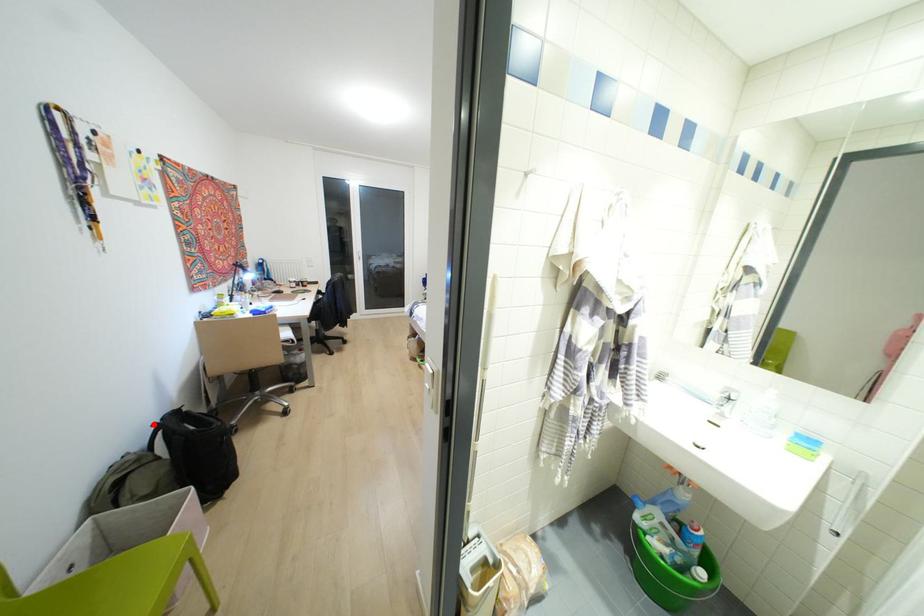
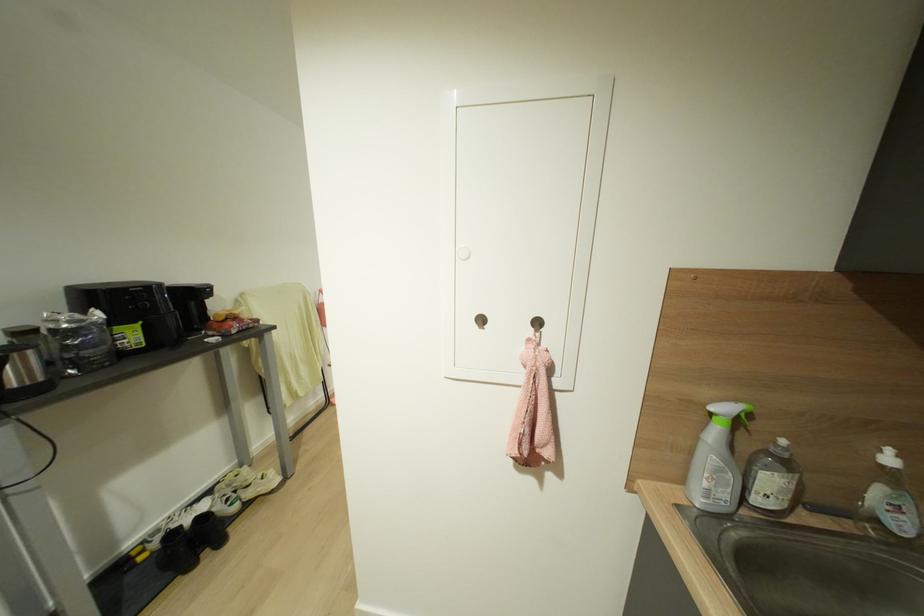
Question: I am providing you with two images of the same scene from different viewpoints. A red point is marked on the first image. Can you still see the location of the red point in image 2?

Choices:
 (A) Yes
 (B) No

Answer: (B)